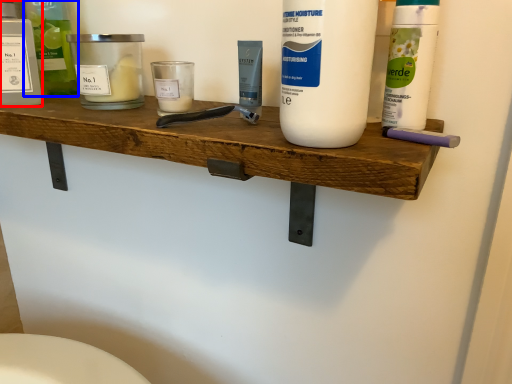
Question: Which object is closer to the camera taking this photo, personal care (highlighted by a red box) or cleaning product (highlighted by a blue box)?

Choices:
 (A) personal care
 (B) cleaning product

Answer: (A)